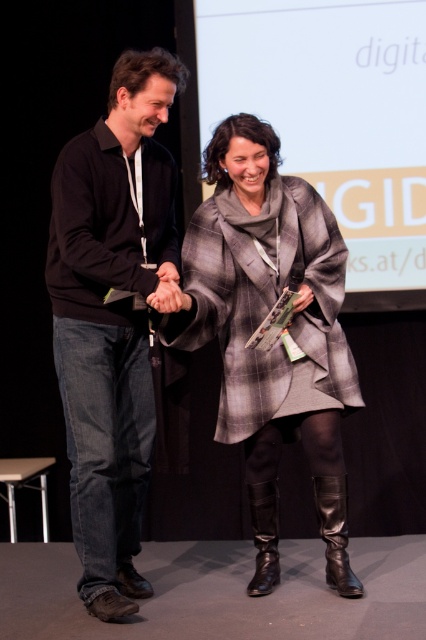
You are a stagehand setting up a microphone stand between the black matte sweater at center and the black leather boot at lower center. The microphone stand requires a minimum of 24 inches of space to be placed safely. Can you position the microphone stand between them?

The distance between the black matte sweater at center and the black leather boot at lower center is 30.12 inches, which exceeds the required 24 inches. Therefore, the microphone stand can be safely positioned between them.

You are a photographer at the event and need to capture a closeup shot of both the plaid wool coat at center and the black leather boot at lower right. Which object requires more space in the frame to fully capture its width?

The plaid wool coat at center requires more space in the frame because its width is larger than the black leather boot at lower right.

You are a photographer standing at the back of the stage. You need to capture a clear photo of both black leather boot at lower right and black leather boot at lower center. Which boot should you focus on first to ensure it appears in the foreground of your photo?

The black leather boot at lower right should be focused on first because it is located above the black leather boot at lower center, meaning it is closer to the photographer and thus in the foreground.